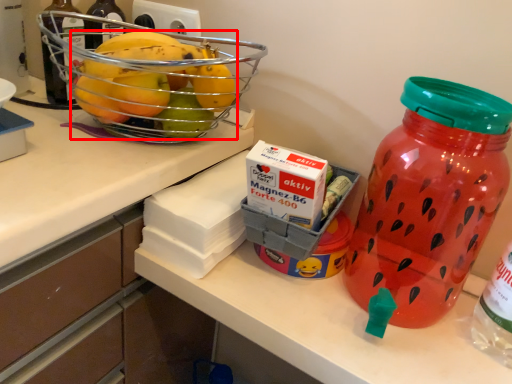
Question: Considering the relative positions of grapefruit (annotated by the red box) and bottle in the image provided, where is grapefruit (annotated by the red box) located with respect to the staircase?

Choices:
 (A) right
 (B) left

Answer: (B)